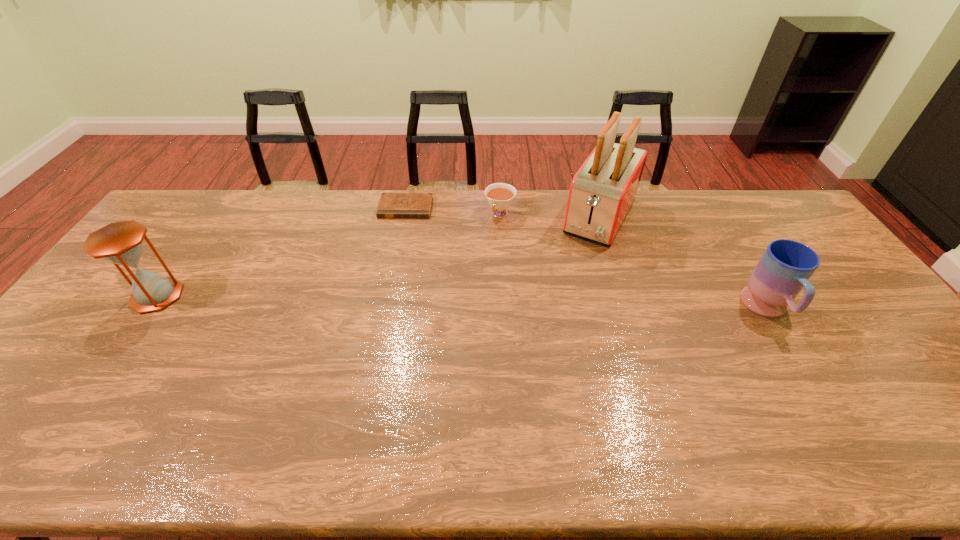
This screenshot has width=960, height=540. In order to click on vacant space on the desktop that is between the fourth shortest object and the mug and is positioned on the side of the second shortest object with the handle in this screenshot , I will do [x=444, y=302].

Image resolution: width=960 pixels, height=540 pixels. Identify the location of vacant space on the desktop that is between the leftmost object and the third shortest object and is positioned on the front-facing side of the tallest object. (549, 305).

I want to click on free space on the desktop that is between the leftmost object and the rightmost object and is positioned on the spine side of the shortest object, so click(x=385, y=301).